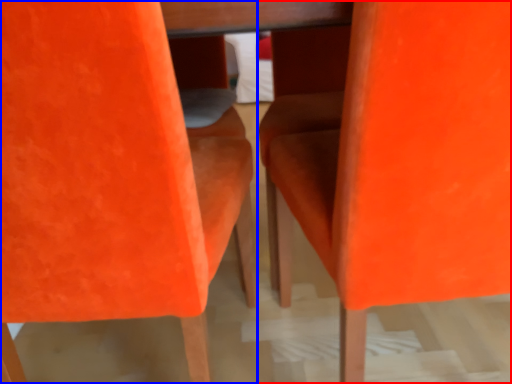
Question: Which object appears closest to the camera in this image, chair (highlighted by a red box) or chair (highlighted by a blue box)?

Choices:
 (A) chair
 (B) chair

Answer: (B)